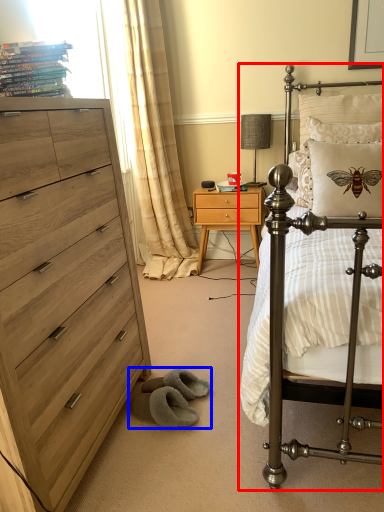
Question: Which object is further to the camera taking this photo, bed (highlighted by a red box) or gray (highlighted by a blue box)?

Choices:
 (A) bed
 (B) gray

Answer: (B)